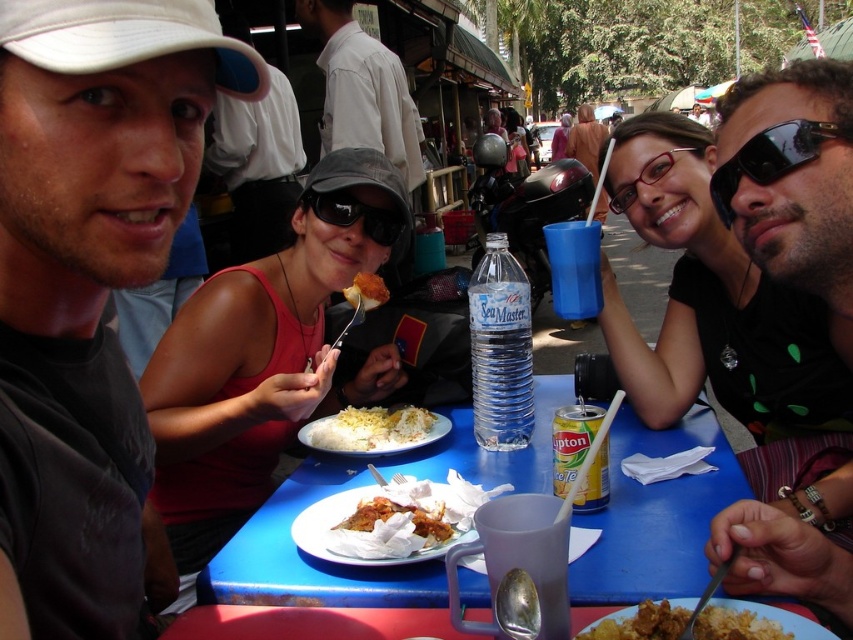
Question: Which of the following is the closest to the observer?

Choices:
 (A) golden crispy pastry at center
 (B) black plastic sunglasses at upper right
 (C) golden crispy fried chicken at center
 (D) matte black sunglasses at upper center

Answer: (B)

Question: Can you confirm if blue plastic table at center is smaller than yellow rice at plate right?

Choices:
 (A) yes
 (B) no

Answer: (B)

Question: Does white cotton shirt at upper center have a greater width compared to matte black sunglasses at upper center?

Choices:
 (A) yes
 (B) no

Answer: (B)

Question: Estimate the real-world distances between objects in this image. Which object is closer to the white paper plate at center?

Choices:
 (A) blue plastic table at center
 (B) black reflective sunglasses at center
 (C) white cotton shirt at upper center
 (D) golden crispy fried chicken at center

Answer: (D)

Question: Is white cotton shirt at upper center thinner than golden crispy fried chicken at center?

Choices:
 (A) no
 (B) yes

Answer: (A)

Question: Among these objects, which one is farthest from the camera?

Choices:
 (A) golden crispy fried chicken at center
 (B) white matte baseball cap at upper left

Answer: (A)